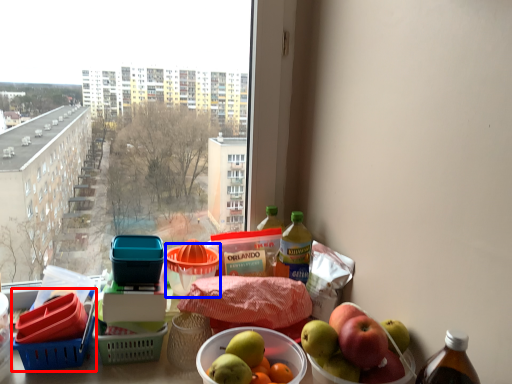
Question: Among these objects, which one is farthest to the camera, basket (highlighted by a red box) or basket (highlighted by a blue box)?

Choices:
 (A) basket
 (B) basket

Answer: (B)